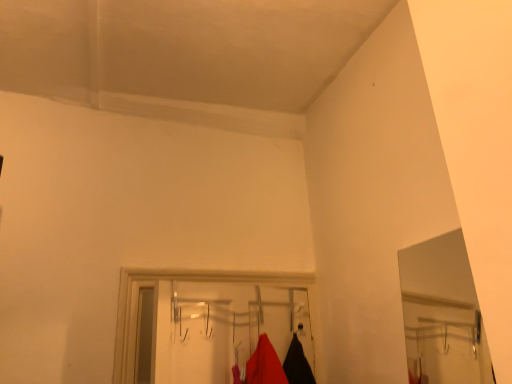
Find the location of a particular element. smooth glass mirror at upper right is located at coordinates (442, 313).

Describe the element at coordinates (442, 313) in the screenshot. I see `smooth glass mirror at upper right` at that location.

This screenshot has height=384, width=512. Find the location of `smooth glass mirror at upper right`. smooth glass mirror at upper right is located at coordinates (442, 313).